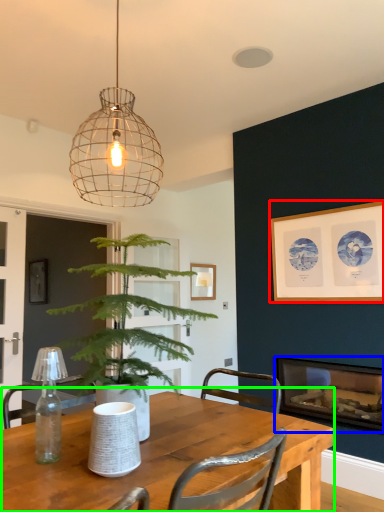
Question: Based on their relative distances, which object is nearer to picture frame (highlighted by a red box)? Choose from fireplace (highlighted by a blue box) and table (highlighted by a green box).

Choices:
 (A) fireplace
 (B) table

Answer: (A)